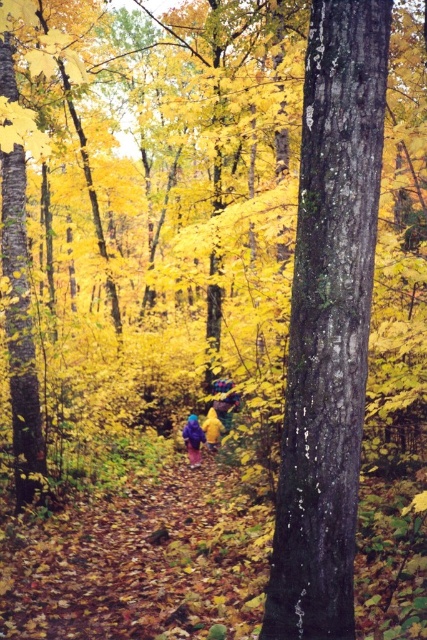
Consider the image. You are a hiker who needs to decide which item to take with you from the path. You see a raincoat at center and a yellow fabric at center. Which item is smaller and more portable?

The raincoat at center is smaller than yellow fabric at center, so it is more portable.

You are a hiker who wants to take a photo of the smooth dark bark tree at center and the raincoat at center. Since you want both subjects to be in focus, you need to know which one is closer to you. Can you determine which is closer?

The smooth dark bark tree at center is much taller than the raincoat at center. Since the tree is taller but also likely farther away, it might be positioned further back, making the raincoat at center closer to you.

From the picture: You are a hiker who wants to take a photo of the yellow fabric at center while standing near the smooth dark bark tree at center. Since the tree is in the way, can you move around it to get a clear shot? Explain why or why not based on their sizes.

The smooth dark bark tree at center is larger than the yellow fabric at center, so you can move around it to get a clear shot. The tree might block part of the view, but its size allows enough space to maneuver around it.